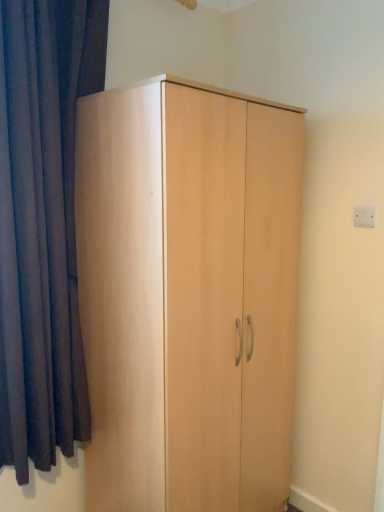
Question: Should I look upward or downward to see white plastic electric outlet at upper right?

Choices:
 (A) up
 (B) down

Answer: (A)

Question: Considering the relative sizes of dark blue fabric at left and white plastic electric outlet at upper right in the image provided, is dark blue fabric at left shorter than white plastic electric outlet at upper right?

Choices:
 (A) no
 (B) yes

Answer: (A)

Question: Is dark blue fabric at left bigger than white plastic electric outlet at upper right?

Choices:
 (A) no
 (B) yes

Answer: (B)

Question: Is dark blue fabric at left smaller than white plastic electric outlet at upper right?

Choices:
 (A) no
 (B) yes

Answer: (A)

Question: Is dark blue fabric at left taller than white plastic electric outlet at upper right?

Choices:
 (A) yes
 (B) no

Answer: (A)

Question: Considering the relative sizes of dark blue fabric at left and white plastic electric outlet at upper right in the image provided, is dark blue fabric at left thinner than white plastic electric outlet at upper right?

Choices:
 (A) yes
 (B) no

Answer: (B)

Question: Is dark blue fabric at left not inside white plastic electric outlet at upper right?

Choices:
 (A) yes
 (B) no

Answer: (A)

Question: Is light wood wardrobe at center next to dark blue fabric at left?

Choices:
 (A) no
 (B) yes

Answer: (A)

Question: Is light wood wardrobe at center outside of dark blue fabric at left?

Choices:
 (A) yes
 (B) no

Answer: (A)

Question: Can you confirm if light wood wardrobe at center is positioned to the left of dark blue fabric at left?

Choices:
 (A) yes
 (B) no

Answer: (B)

Question: Is light wood wardrobe at center looking in the opposite direction of dark blue fabric at left?

Choices:
 (A) no
 (B) yes

Answer: (A)

Question: Does light wood wardrobe at center lie behind dark blue fabric at left?

Choices:
 (A) yes
 (B) no

Answer: (A)

Question: Is light wood wardrobe at center thinner than dark blue fabric at left?

Choices:
 (A) yes
 (B) no

Answer: (B)

Question: Does dark blue fabric at left have a greater height compared to light wood wardrobe at center?

Choices:
 (A) yes
 (B) no

Answer: (B)